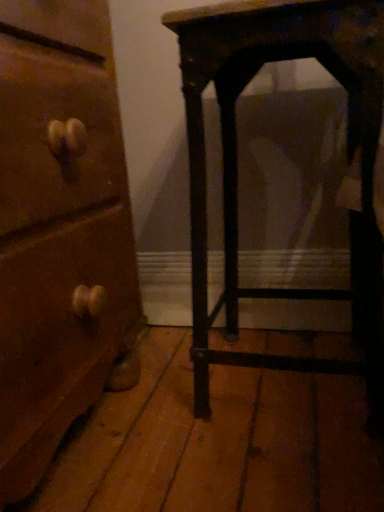
The image size is (384, 512). I want to click on vacant area that is in front of dark wood table at right, so pyautogui.click(x=280, y=465).